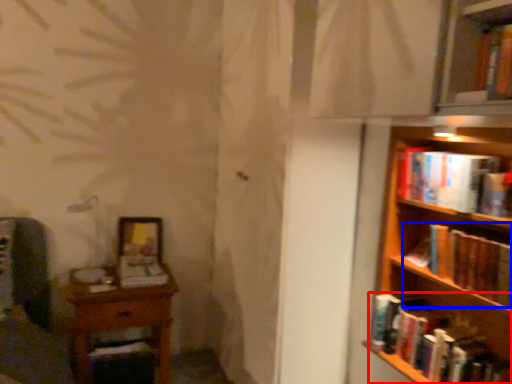
Question: Which object is further to the camera taking this photo, book (highlighted by a red box) or book (highlighted by a blue box)?

Choices:
 (A) book
 (B) book

Answer: (A)